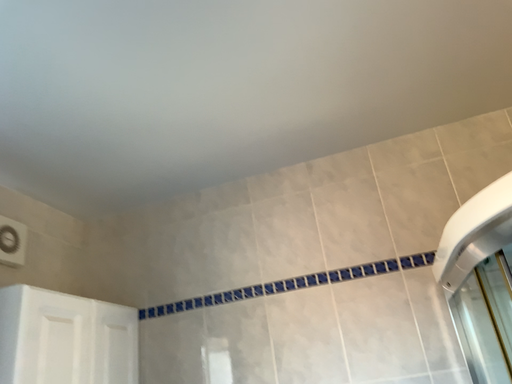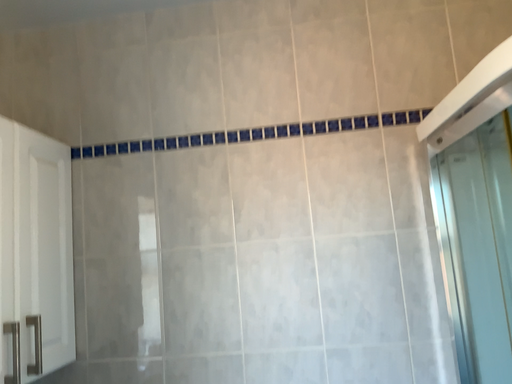
Question: Which way did the camera rotate in the video?

Choices:
 (A) rotated left
 (B) rotated right

Answer: (B)